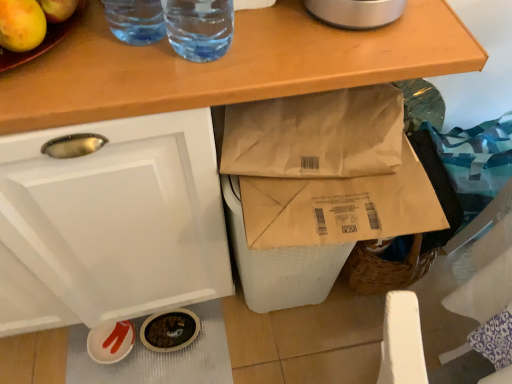
What do you see at coordinates (136, 20) in the screenshot? The height and width of the screenshot is (384, 512). I see `transparent plastic straw at upper center, positioned as the second drinking straw in right-to-left order` at bounding box center [136, 20].

What is the approximate width of transparent plastic straw at upper center, the first drinking straw in the left-to-right sequence?

Answer: transparent plastic straw at upper center, the first drinking straw in the left-to-right sequence, is 3.90 inches in width.

The height and width of the screenshot is (384, 512). What are the coordinates of `transparent plastic straw at upper center, the first drinking straw in the left-to-right sequence` in the screenshot? It's located at (136, 20).

Measure the distance between transparent plastic straw at upper center, marked as the 1th drinking straw in a right-to-left arrangement, and camera.

transparent plastic straw at upper center, marked as the 1th drinking straw in a right-to-left arrangement, and camera are 60.29 centimeters apart from each other.

This screenshot has width=512, height=384. What do you see at coordinates (199, 27) in the screenshot?
I see `transparent plastic straw at upper center, which is the 2th drinking straw from left to right` at bounding box center [199, 27].

Find the location of a particular element. The image size is (512, 384). transparent plastic straw at upper center, marked as the 1th drinking straw in a right-to-left arrangement is located at coordinates pos(199,27).

The height and width of the screenshot is (384, 512). What are the coordinates of `transparent plastic straw at upper center, positioned as the second drinking straw in right-to-left order` in the screenshot? It's located at (136, 20).

Which is more to the right, transparent plastic straw at upper center, marked as the 1th drinking straw in a right-to-left arrangement, or transparent plastic straw at upper center, the first drinking straw in the left-to-right sequence?

transparent plastic straw at upper center, marked as the 1th drinking straw in a right-to-left arrangement.

Considering the relative positions of transparent plastic straw at upper center, marked as the 1th drinking straw in a right-to-left arrangement, and transparent plastic straw at upper center, positioned as the second drinking straw in right-to-left order, in the image provided, is transparent plastic straw at upper center, marked as the 1th drinking straw in a right-to-left arrangement, in front of transparent plastic straw at upper center, positioned as the second drinking straw in right-to-left order,?

That is True.

Between point (209, 27) and point (120, 18), which one is positioned behind?

The point (209, 27) is farther.

From the image's perspective, is transparent plastic straw at upper center, which is the 2th drinking straw from left to right, located above transparent plastic straw at upper center, the first drinking straw in the left-to-right sequence?

Actually, transparent plastic straw at upper center, which is the 2th drinking straw from left to right, appears below transparent plastic straw at upper center, the first drinking straw in the left-to-right sequence, in the image.

From a real-world perspective, is transparent plastic straw at upper center, which is the 2th drinking straw from left to right, on top of transparent plastic straw at upper center, positioned as the second drinking straw in right-to-left order?

Yes, from a real-world perspective, transparent plastic straw at upper center, which is the 2th drinking straw from left to right, is above transparent plastic straw at upper center, positioned as the second drinking straw in right-to-left order.

Does transparent plastic straw at upper center, marked as the 1th drinking straw in a right-to-left arrangement, have a lesser width compared to transparent plastic straw at upper center, positioned as the second drinking straw in right-to-left order?

No.

Consider the image. Between transparent plastic straw at upper center, marked as the 1th drinking straw in a right-to-left arrangement, and transparent plastic straw at upper center, the first drinking straw in the left-to-right sequence, which one has more height?

transparent plastic straw at upper center, the first drinking straw in the left-to-right sequence.

Which of these two, transparent plastic straw at upper center, which is the 2th drinking straw from left to right, or transparent plastic straw at upper center, positioned as the second drinking straw in right-to-left order, is smaller?

transparent plastic straw at upper center, positioned as the second drinking straw in right-to-left order.

Would you say transparent plastic straw at upper center, marked as the 1th drinking straw in a right-to-left arrangement, is outside transparent plastic straw at upper center, positioned as the second drinking straw in right-to-left order?

Yes, transparent plastic straw at upper center, marked as the 1th drinking straw in a right-to-left arrangement, is located beyond the bounds of transparent plastic straw at upper center, positioned as the second drinking straw in right-to-left order.

Are transparent plastic straw at upper center, marked as the 1th drinking straw in a right-to-left arrangement, and transparent plastic straw at upper center, the first drinking straw in the left-to-right sequence, far apart?

No, transparent plastic straw at upper center, marked as the 1th drinking straw in a right-to-left arrangement, is not far away from transparent plastic straw at upper center, the first drinking straw in the left-to-right sequence.

Is transparent plastic straw at upper center, which is the 2th drinking straw from left to right, aimed at transparent plastic straw at upper center, positioned as the second drinking straw in right-to-left order?

No, transparent plastic straw at upper center, which is the 2th drinking straw from left to right, is not facing towards transparent plastic straw at upper center, positioned as the second drinking straw in right-to-left order.

You are a GUI agent. You are given a task and a screenshot of the screen. Output one action in this format:
    pyautogui.click(x=<x>, y=<y>)
    Task: Click on the drinking straw that is behind the transparent plastic straw at upper center, which is the 2th drinking straw from left to right
    
    Given the screenshot: What is the action you would take?
    pyautogui.click(x=136, y=20)

Considering the positions of objects transparent plastic straw at upper center, positioned as the second drinking straw in right-to-left order, and transparent plastic straw at upper center, which is the 2th drinking straw from left to right, in the image provided, who is more to the left, transparent plastic straw at upper center, positioned as the second drinking straw in right-to-left order, or transparent plastic straw at upper center, which is the 2th drinking straw from left to right,?

From the viewer's perspective, transparent plastic straw at upper center, positioned as the second drinking straw in right-to-left order, appears more on the left side.

Which is in front, transparent plastic straw at upper center, the first drinking straw in the left-to-right sequence, or transparent plastic straw at upper center, marked as the 1th drinking straw in a right-to-left arrangement?

transparent plastic straw at upper center, marked as the 1th drinking straw in a right-to-left arrangement, is in front.

Does point (150, 7) appear closer or farther from the camera than point (176, 37)?

Point (150, 7) is closer to the camera than point (176, 37).

From the image's perspective, which one is positioned higher, transparent plastic straw at upper center, the first drinking straw in the left-to-right sequence, or transparent plastic straw at upper center, which is the 2th drinking straw from left to right?

transparent plastic straw at upper center, the first drinking straw in the left-to-right sequence, from the image's perspective.

From a real-world perspective, is transparent plastic straw at upper center, positioned as the second drinking straw in right-to-left order, above or below transparent plastic straw at upper center, which is the 2th drinking straw from left to right?

transparent plastic straw at upper center, positioned as the second drinking straw in right-to-left order, is below transparent plastic straw at upper center, which is the 2th drinking straw from left to right.

Which of these two, transparent plastic straw at upper center, positioned as the second drinking straw in right-to-left order, or transparent plastic straw at upper center, which is the 2th drinking straw from left to right, is wider?

transparent plastic straw at upper center, which is the 2th drinking straw from left to right.

Is transparent plastic straw at upper center, the first drinking straw in the left-to-right sequence, shorter than transparent plastic straw at upper center, marked as the 1th drinking straw in a right-to-left arrangement?

No.

Is transparent plastic straw at upper center, the first drinking straw in the left-to-right sequence, bigger than transparent plastic straw at upper center, which is the 2th drinking straw from left to right?

No.

Would you say transparent plastic straw at upper center, positioned as the second drinking straw in right-to-left order, is inside or outside transparent plastic straw at upper center, which is the 2th drinking straw from left to right?

transparent plastic straw at upper center, positioned as the second drinking straw in right-to-left order, exists outside the volume of transparent plastic straw at upper center, which is the 2th drinking straw from left to right.

Does transparent plastic straw at upper center, the first drinking straw in the left-to-right sequence, touch transparent plastic straw at upper center, which is the 2th drinking straw from left to right?

Absolutely, transparent plastic straw at upper center, the first drinking straw in the left-to-right sequence, is next to and touching transparent plastic straw at upper center, which is the 2th drinking straw from left to right.

Could you tell me if transparent plastic straw at upper center, the first drinking straw in the left-to-right sequence, is facing transparent plastic straw at upper center, which is the 2th drinking straw from left to right?

No.

The height and width of the screenshot is (384, 512). Identify the location of drinking straw below the transparent plastic straw at upper center, marked as the 1th drinking straw in a right-to-left arrangement (from a real-world perspective). [136, 20].

You are a GUI agent. You are given a task and a screenshot of the screen. Output one action in this format:
    pyautogui.click(x=<x>, y=<y>)
    Task: Click on the drinking straw below the transparent plastic straw at upper center, the first drinking straw in the left-to-right sequence (from the image's perspective)
    Image resolution: width=512 pixels, height=384 pixels.
    Given the screenshot: What is the action you would take?
    pyautogui.click(x=199, y=27)

This screenshot has height=384, width=512. What are the coordinates of `drinking straw above the transparent plastic straw at upper center, marked as the 1th drinking straw in a right-to-left arrangement (from the image's perspective)` in the screenshot? It's located at (x=136, y=20).